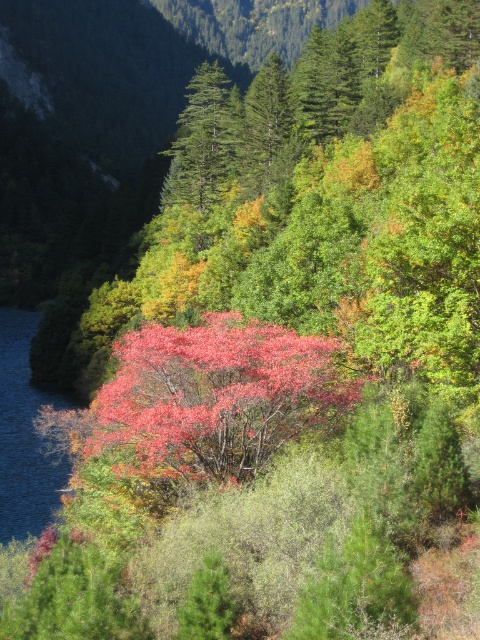
You are a hiker who wants to cross the forest. You see the blue liquid water at left and the green matte tree at center. Which one is wider?

The blue liquid water at left is wider than the green matte tree at center.

You are a hiker carrying a 2.5 meter long tent pole. You need to set up camp between the blue liquid water at left and the green matte tree at center. Can your tent pole fit horizontally in that space?

The distance between the blue liquid water at left and the green matte tree at center is 36.34 meters, so yes, the tent pole which is 2.5 meters long can fit horizontally in that space since it is shorter than the available distance.